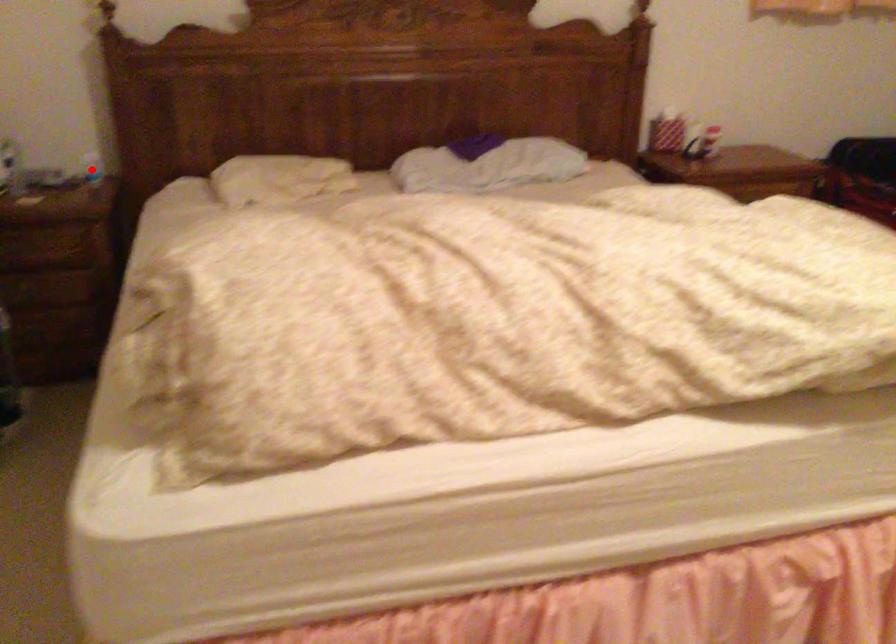
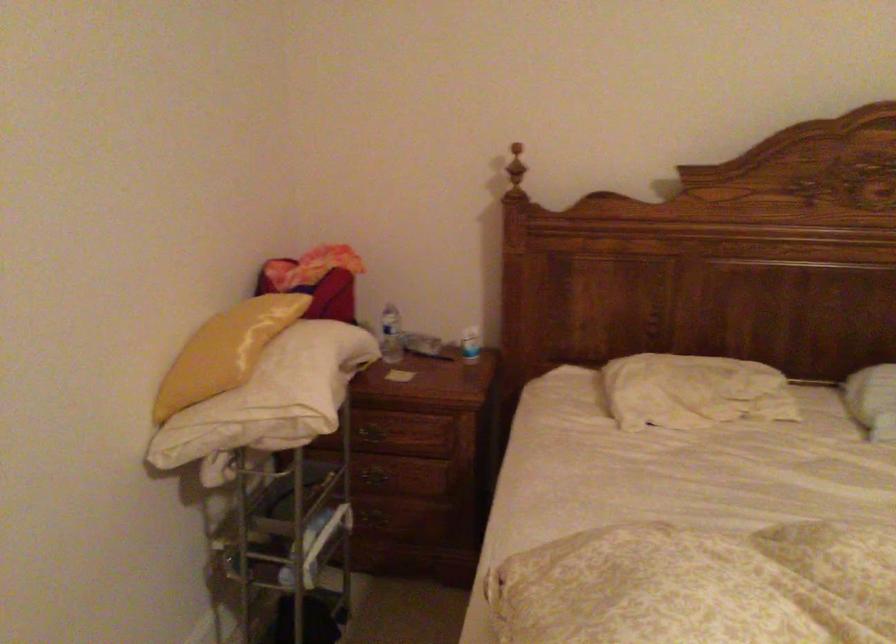
Question: A red point is marked in image1. In image2, is the corresponding 3D point closer to the camera or farther? Reply with the corresponding letter.

Choices:
 (A) The corresponding 3D point is closer.
 (B) The corresponding 3D point is farther.

Answer: (A)